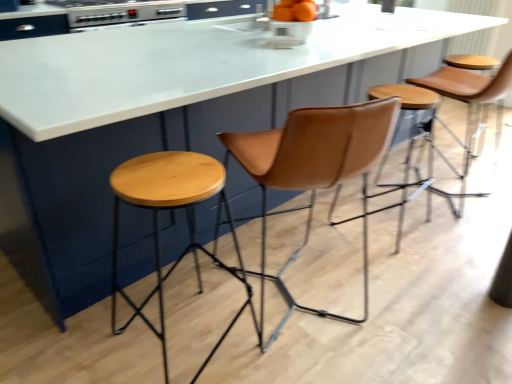
Find the location of `free region under leather stool at center, the second stool from the front (from a real-world perspective)`. free region under leather stool at center, the second stool from the front (from a real-world perspective) is located at coordinates tap(389, 225).